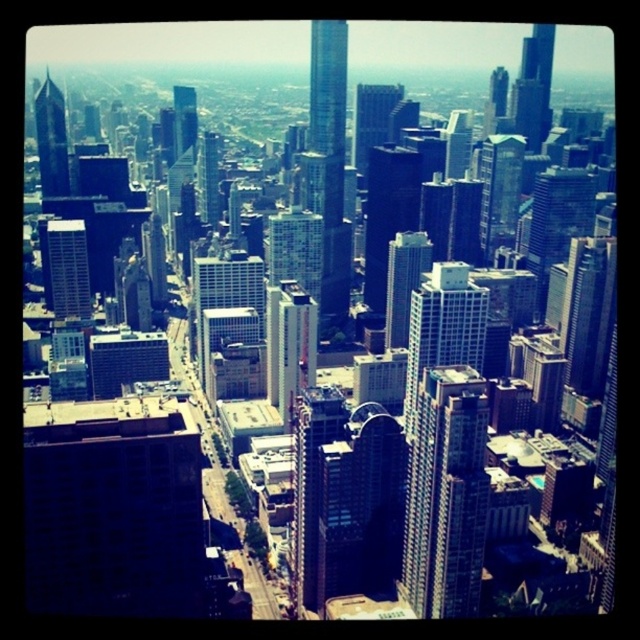
Question: Does matte glass skyscraper at center-left appear on the left side of shiny glass skyscraper at upper left?

Choices:
 (A) yes
 (B) no

Answer: (B)

Question: Estimate the real-world distances between objects in this image. Which object is closer to the glassy reflective skyscraper at center?

Choices:
 (A) sleek glass skyscraper at center
 (B) shiny glass skyscraper at upper left

Answer: (B)

Question: Which point is closer to the camera?

Choices:
 (A) (182, 108)
 (B) (74, 282)
 (C) (330, 36)

Answer: (A)

Question: Is sleek glass skyscraper at center thinner than glassy reflective skyscraper at center?

Choices:
 (A) no
 (B) yes

Answer: (A)

Question: Estimate the real-world distances between objects in this image. Which object is farther from the sleek glass skyscraper at center?

Choices:
 (A) glassy reflective skyscraper at center
 (B) shiny glass skyscraper at upper left

Answer: (B)

Question: Is matte glass skyscraper at center-left positioned behind glassy reflective skyscraper at center?

Choices:
 (A) no
 (B) yes

Answer: (B)